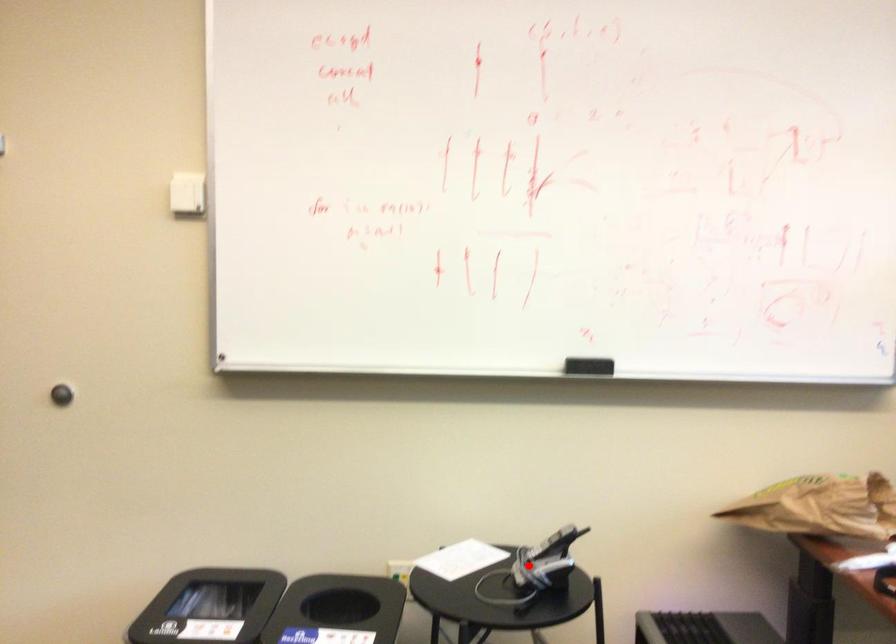
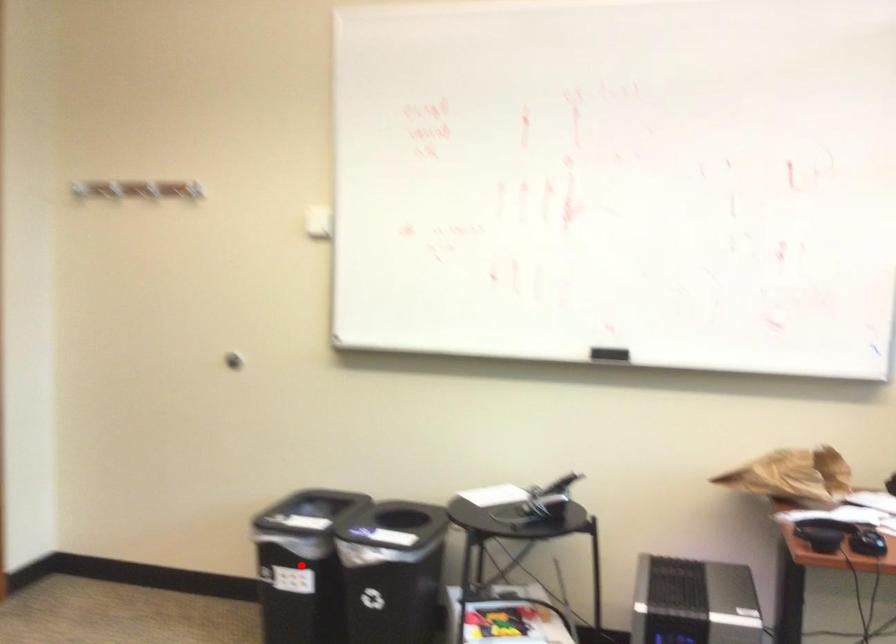
I am providing you with two images of the same scene from different viewpoints. A red point is marked on the first image and another point is marked on the second image. Is the red point in image1 aligned with the point shown in image2?

No